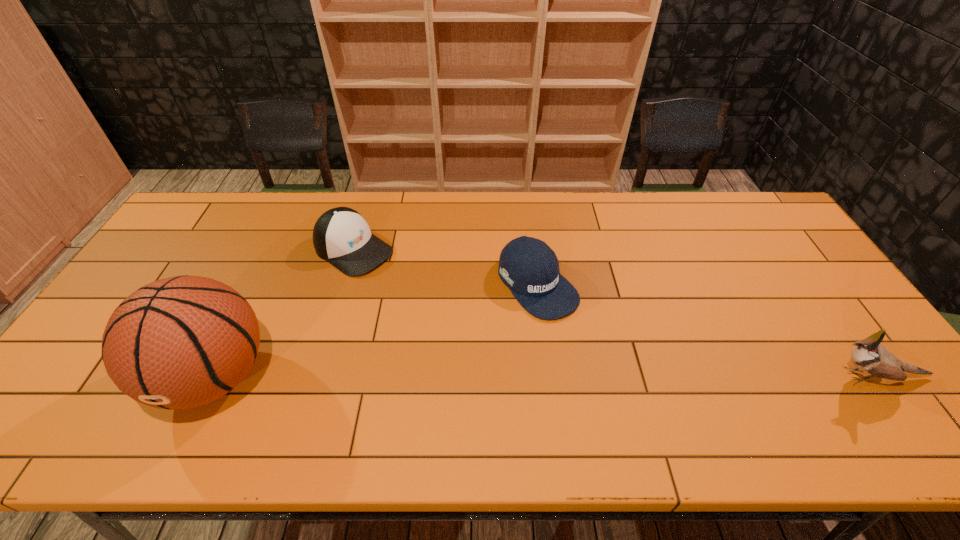
At what (x,y) coordinates should I click in order to perform the action: click on free spot located on the front panel of the cap. Please return your answer as a coordinate pair (x, y). The width and height of the screenshot is (960, 540). Looking at the image, I should click on (442, 307).

The image size is (960, 540). Identify the location of free region located on the front-facing side of the third object from left to right. (615, 375).

Locate an element on the screen. The image size is (960, 540). vacant space situated 0.190m on the front-facing side of the third object from left to right is located at coordinates coord(610,368).

Find the location of a particular element. vacant space situated 0.070m on the front-facing side of the third object from left to right is located at coordinates (579, 334).

Identify the location of object located at the far edge. (341, 236).

This screenshot has height=540, width=960. Identify the location of basketball located at the near edge. (181, 342).

Identify the location of bird that is at the near edge. (869, 356).

Locate an element on the screen. Image resolution: width=960 pixels, height=540 pixels. object that is at the right edge is located at coordinates (869, 356).

The height and width of the screenshot is (540, 960). I want to click on object present at the near right corner, so click(869, 356).

Where is `blank space at the far edge of the desktop`? blank space at the far edge of the desktop is located at coordinates (246, 230).